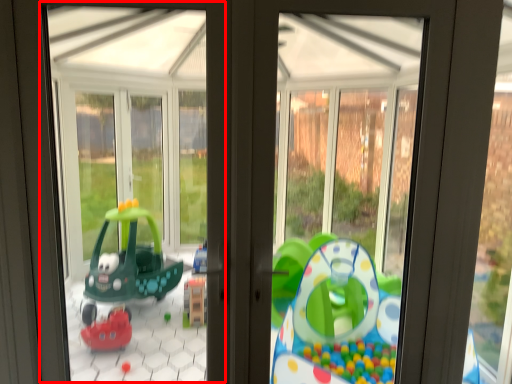
Question: From the image, what is the correct spatial relationship of bay window (annotated by the red box) in relation to window frame?

Choices:
 (A) right
 (B) left

Answer: (B)